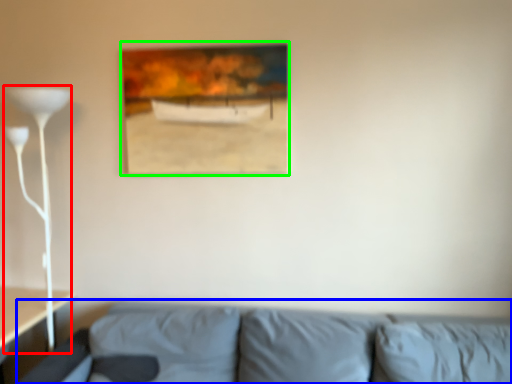
Question: Estimate the real-world distances between objects in this image. Which object is closer to table lamp (highlighted by a red box), studio couch (highlighted by a blue box) or picture frame (highlighted by a green box)?

Choices:
 (A) studio couch
 (B) picture frame

Answer: (B)